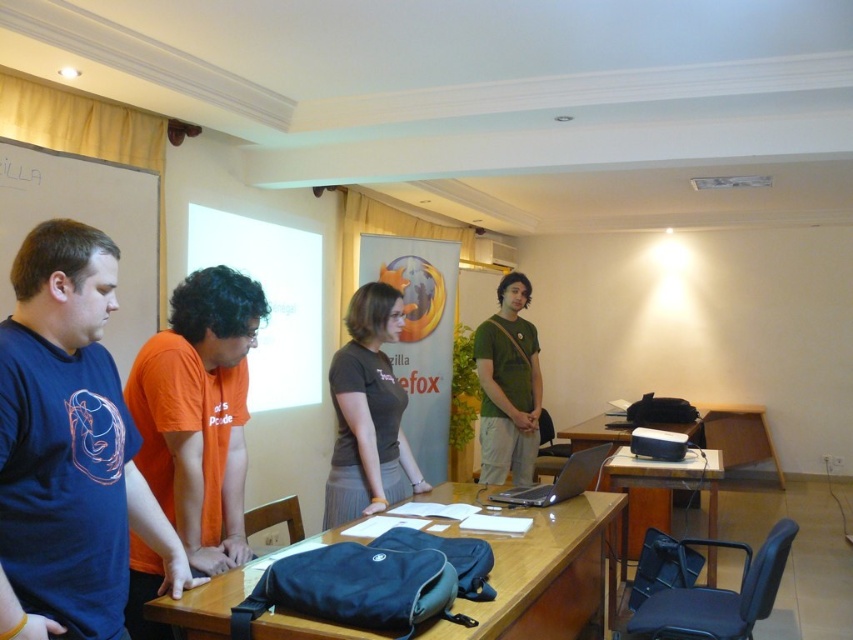
Is blue fabric bag at center closer to the viewer compared to green matte shirt at center?

Yes, it is in front of green matte shirt at center.

Does blue fabric bag at center appear under green matte shirt at center?

Yes.

Is point (572, 544) closer to viewer compared to point (512, 369)?

Yes, it is in front of point (512, 369).

I want to click on blue fabric bag at center, so click(x=548, y=573).

Is blue fabric bag at center wider than satin silver laptop at center?

Correct, the width of blue fabric bag at center exceeds that of satin silver laptop at center.

Who is positioned more to the left, blue fabric bag at center or satin silver laptop at center?

From the viewer's perspective, blue fabric bag at center appears more on the left side.

Image resolution: width=853 pixels, height=640 pixels. Find the location of `blue fabric bag at center`. blue fabric bag at center is located at coordinates (548, 573).

Locate an element on the screen. The image size is (853, 640). blue fabric bag at center is located at coordinates (548, 573).

Which of these two, matte black table at lower right or satin silver laptop at center, stands taller?

matte black table at lower right is taller.

Does matte black table at lower right appear over satin silver laptop at center?

Incorrect, matte black table at lower right is not positioned above satin silver laptop at center.

You are a GUI agent. You are given a task and a screenshot of the screen. Output one action in this format:
    pyautogui.click(x=<x>, y=<y>)
    Task: Click on the matte black table at lower right
    The height and width of the screenshot is (640, 853).
    Given the screenshot: What is the action you would take?
    pyautogui.click(x=662, y=481)